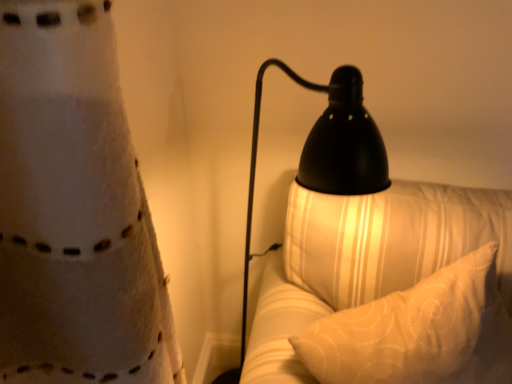
Question: Can you confirm if white textured pillow at right is positioned to the left of black matte lamp at right?

Choices:
 (A) yes
 (B) no

Answer: (B)

Question: Is white textured pillow at right with black matte lamp at right?

Choices:
 (A) no
 (B) yes

Answer: (A)

Question: Considering the relative sizes of white textured pillow at right and black matte lamp at right in the image provided, is white textured pillow at right smaller than black matte lamp at right?

Choices:
 (A) yes
 (B) no

Answer: (B)

Question: Could you tell me if white textured pillow at right is facing black matte lamp at right?

Choices:
 (A) yes
 (B) no

Answer: (B)

Question: Is white textured pillow at right wider than black matte lamp at right?

Choices:
 (A) yes
 (B) no

Answer: (B)

Question: Is white textured pillow at right taller than black matte lamp at right?

Choices:
 (A) yes
 (B) no

Answer: (B)

Question: Is black matte lamp at right positioned before white textured pillow at right?

Choices:
 (A) yes
 (B) no

Answer: (A)

Question: Is black matte lamp at right directly adjacent to white textured pillow at right?

Choices:
 (A) no
 (B) yes

Answer: (A)

Question: Is black matte lamp at right oriented towards white textured pillow at right?

Choices:
 (A) yes
 (B) no

Answer: (A)

Question: From a real-world perspective, is black matte lamp at right located beneath white textured pillow at right?

Choices:
 (A) no
 (B) yes

Answer: (A)

Question: From the image's perspective, is black matte lamp at right under white textured pillow at right?

Choices:
 (A) no
 (B) yes

Answer: (A)

Question: Considering the relative sizes of black matte lamp at right and white textured pillow at right in the image provided, is black matte lamp at right smaller than white textured pillow at right?

Choices:
 (A) no
 (B) yes

Answer: (B)

Question: Choose the correct answer: Is black matte lamp at right inside white textured pillow at right or outside it?

Choices:
 (A) inside
 (B) outside

Answer: (B)